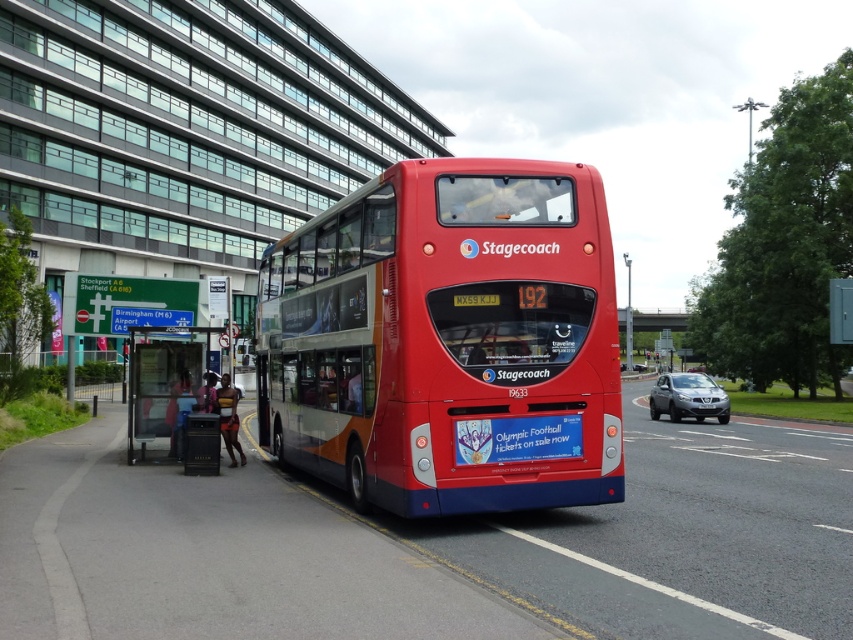
Does satin silver car at center have a larger size compared to white plastic license plate at center?

Yes, satin silver car at center is bigger than white plastic license plate at center.

The image size is (853, 640). In order to click on satin silver car at center in this screenshot , I will do `click(688, 397)`.

Can you confirm if shiny red bus at center is wider than satin silver car at center?

Incorrect, shiny red bus at center's width does not surpass satin silver car at center's.

Is point (398, 316) behind point (722, 422)?

No, it is in front of (722, 422).

This screenshot has width=853, height=640. Describe the element at coordinates (447, 340) in the screenshot. I see `shiny red bus at center` at that location.

In order to click on shiny red bus at center in this screenshot , I will do `click(447, 340)`.

From the picture: Which is below, shiny red bus at center or white plastic license plate at center?

white plastic license plate at center is below.

Locate an element on the screen. This screenshot has width=853, height=640. shiny red bus at center is located at coordinates (447, 340).

Who is more distant from viewer, (440, 314) or (711, 400)?

The point (711, 400) is more distant.

Identify the location of shiny red bus at center. The image size is (853, 640). (447, 340).